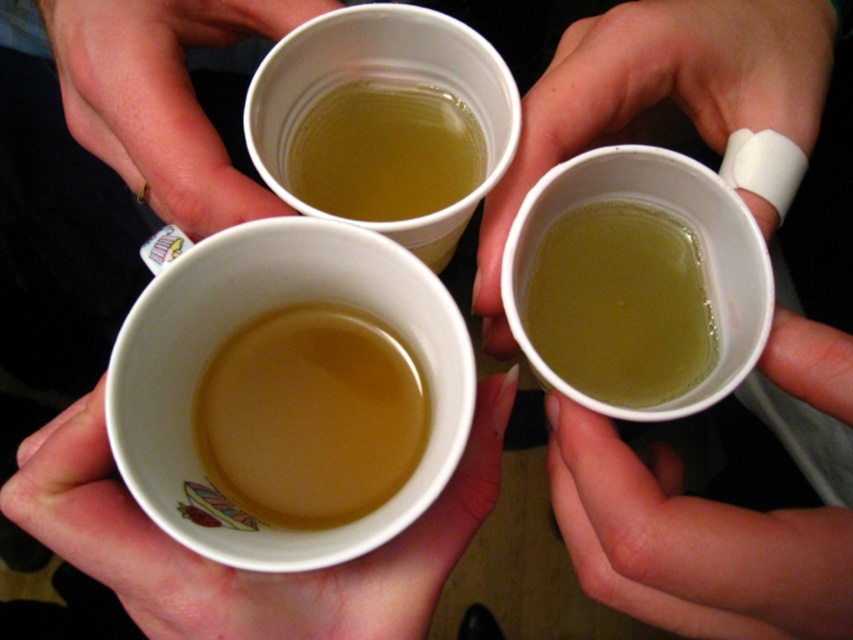
Question: Can you confirm if white bandage at right is bigger than white matte paper cup at upper center?

Choices:
 (A) no
 (B) yes

Answer: (B)

Question: Which object is the closest to the brown matte cup at center?

Choices:
 (A) white bandage at right
 (B) white matte paper cup at upper center

Answer: (B)

Question: Is brown matte cup at center to the left of translucent paper cup at upper center from the viewer's perspective?

Choices:
 (A) yes
 (B) no

Answer: (A)

Question: Estimate the real-world distances between objects in this image. Which object is farther from the translucent paper cup at upper center?

Choices:
 (A) white matte paper cup at upper center
 (B) white matte cup at center
 (C) white bandage at right
 (D) brown matte cup at center

Answer: (B)

Question: Which object is closer to the camera taking this photo?

Choices:
 (A) white matte paper cup at upper center
 (B) white matte cup at center
 (C) brown matte cup at center
 (D) translucent paper cup at upper center

Answer: (B)

Question: Does white matte cup at center have a lesser width compared to brown matte cup at center?

Choices:
 (A) no
 (B) yes

Answer: (A)